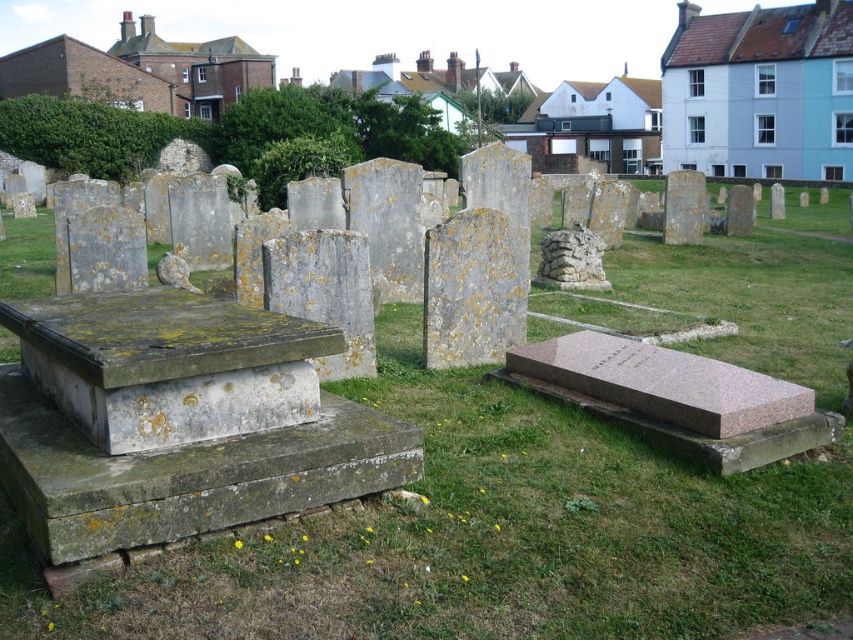
You are standing at the entrance of the cemetery and want to take a photo of both the point at coordinates point (x=669, y=481) and the point at coordinates point (x=474, y=250). Since you can only focus on one point at a time, which point should you focus on first to ensure the other is still in the background?

You should focus on point (x=669, y=481) first because it is in front of point (x=474, y=250). By focusing on the closer point, the farther one will still be in the background of the photo.

You are standing in the cemetery and want to place a small flowerpot on the ground. You have two options for placement near the center area. The first option is on the green mossy grass at center, and the second is on the green mossy stone at center. Which surface will allow the flowerpot to be placed higher above the ground?

The green mossy grass at center is taller than the green mossy stone at center, so placing the flowerpot on the green mossy grass at center will result in the flowerpot being higher above the ground.

You are standing in the cemetery and want to place a small flowerpot between the green mossy grass at center and the green mossy stone at center. Which object should you place the flowerpot closer to if you want it to be on the left side of the stone?

You should place the flowerpot closer to the green mossy grass at center because it is already to the left of the green mossy stone at center.